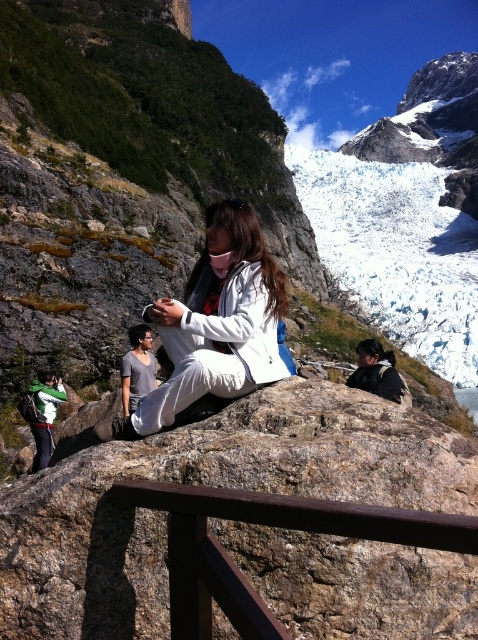
Question: Among these points, which one is farthest from the camera?

Choices:
 (A) (319, 419)
 (B) (390, 353)

Answer: (B)

Question: Is brown rough rock at center to the left of matte black jacket at center from the viewer's perspective?

Choices:
 (A) yes
 (B) no

Answer: (A)

Question: Estimate the real-world distances between objects in this image. Which object is farther from the brown wood rail at center?

Choices:
 (A) white matte jacket at center
 (B) matte black jacket at center
 (C) brown rough rock at center

Answer: (B)

Question: Is brown rough rock at center positioned at the back of white matte jacket at center?

Choices:
 (A) no
 (B) yes

Answer: (A)

Question: Does brown rough rock at center appear on the left side of white matte jacket at center?

Choices:
 (A) no
 (B) yes

Answer: (A)

Question: Which object is positioned closest to the white matte jacket at center?

Choices:
 (A) matte black jacket at center
 (B) brown wood rail at center
 (C) brown rough rock at center

Answer: (C)